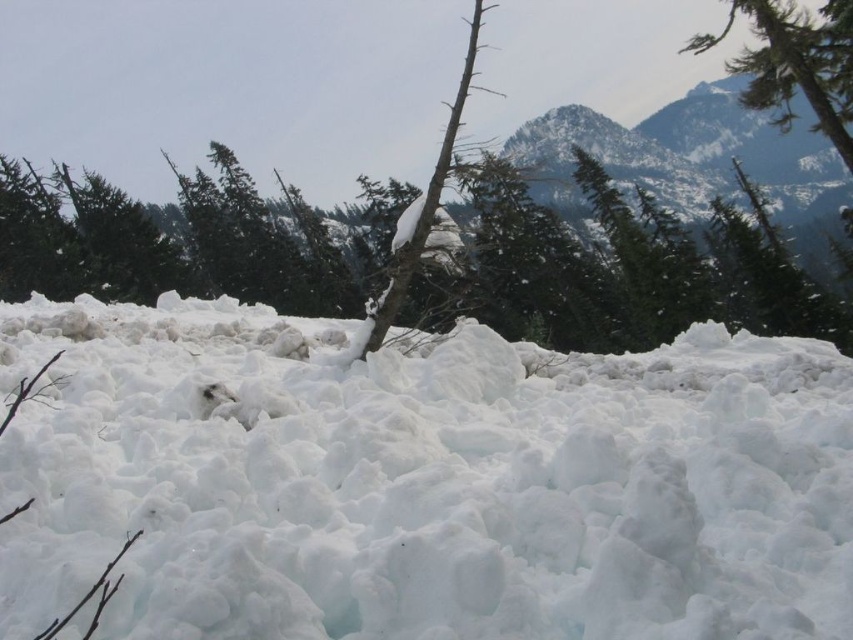
You are an explorer trying to cross the snowy landscape. You see the white fluffy snow at center and the snowy rocky mountain at upper center. Which direction should you head to move towards the mountain?

You should head to the right because the white fluffy snow at center is to the left of the snowy rocky mountain at upper center, so moving right would take you toward the mountain.